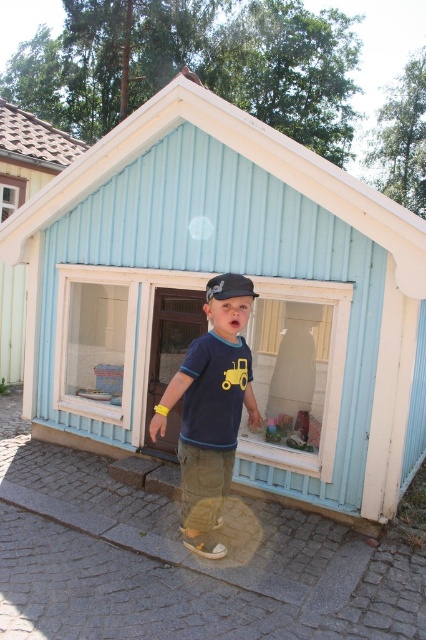
You are standing in front of the playhouse and want to place a small toy on the light blue wood at center. Where exactly should you place it?

The light blue wood at center is located at point (253, 301), so you should place the small toy there.

You are standing in front of the playhouse and notice two points marked on the cobblestone surface. The first point is at coordinates point [288,176] and the second is at point [11,268]. Which point is closer to your current position?

Point [288,176] is closer to the camera than point [11,268], so the first point is closer to your current position.

You are standing at the entrance of the playhouse and want to hand a toy to a child wearing the matte blue shirt at center. The toy is placed on the light blue wood at upper left. Can you reach the toy without moving from your current position?

The matte blue shirt at center is 14.09 feet away from the light blue wood at upper left, so you cannot reach the toy without moving closer.